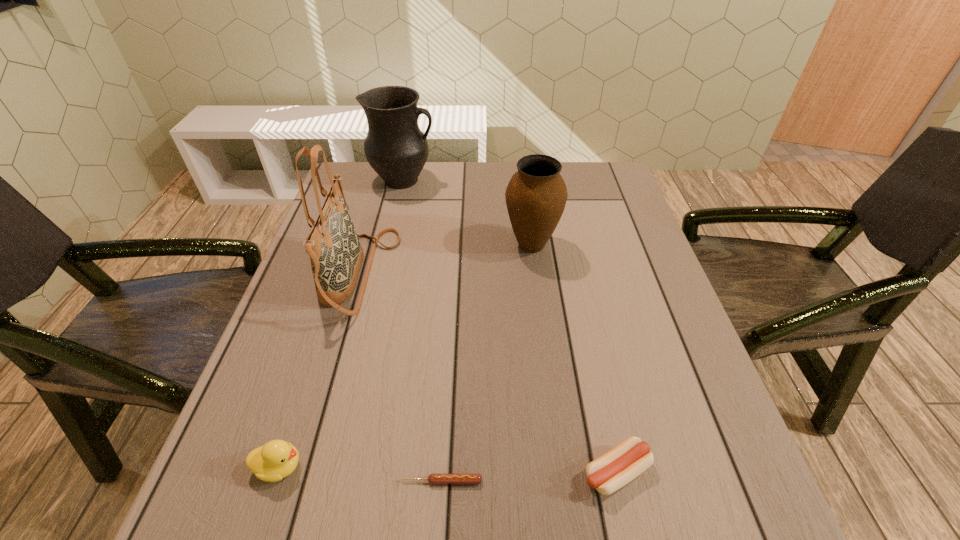
This screenshot has width=960, height=540. Identify the location of free space between the taller sausage and the duckling. [447, 469].

The image size is (960, 540). In order to click on vacant space that's between the tallest object and the urn in this screenshot , I will do `click(445, 259)`.

This screenshot has width=960, height=540. What are the coordinates of `vacant space in between the duckling and the urn` in the screenshot? It's located at (405, 355).

I want to click on vacant region between the tallest object and the duckling, so click(319, 370).

Find the location of a particular element. This screenshot has height=540, width=960. free space between the right sausage and the farthest object is located at coordinates (510, 326).

You are a GUI agent. You are given a task and a screenshot of the screen. Output one action in this format:
    pyautogui.click(x=<x>, y=<y>)
    Task: Click on the free space between the urn and the duckling
    This screenshot has height=540, width=960.
    Given the screenshot: What is the action you would take?
    pyautogui.click(x=405, y=355)

Find the location of a particular element. vacant point located between the urn and the right sausage is located at coordinates (573, 358).

What are the coordinates of `object identified as the fourth closest to the pitcher` in the screenshot? It's located at (435, 479).

Locate which object is the third closest to the taller sausage. Please provide its 2D coordinates. Your answer should be formatted as a tuple, i.e. [(x, y)], where the tuple contains the x and y coordinates of a point satisfying the conditions above.

[(277, 459)]

At what (x,y) coordinates should I click in order to perform the action: click on vacant space that satisfies the following two spatial constraints: 1. on the front-facing side of the tallest object; 2. on the right side of the left sausage. Please return your answer as a coordinate pair (x, y). This screenshot has height=540, width=960. Looking at the image, I should click on (300, 481).